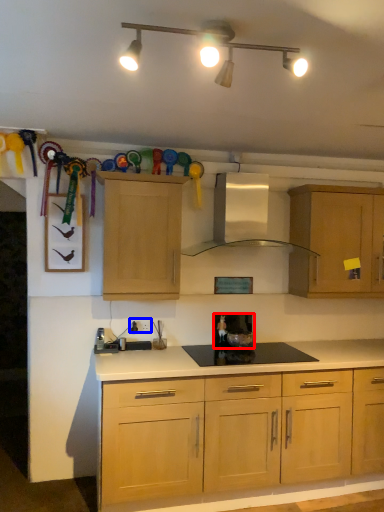
Question: Which object is further to the camera taking this photo, appliance (highlighted by a red box) or electric outlet (highlighted by a blue box)?

Choices:
 (A) appliance
 (B) electric outlet

Answer: (A)